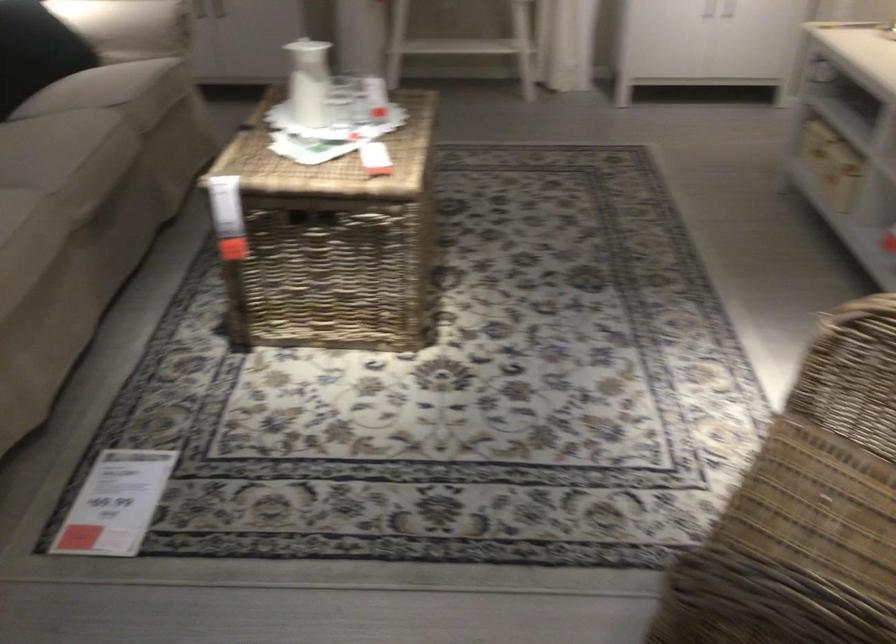
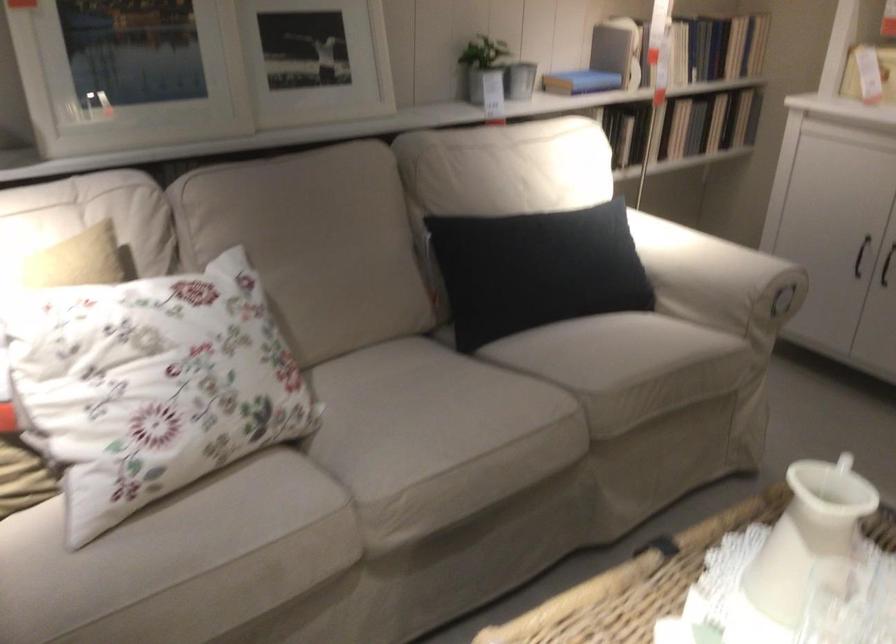
The point at (73, 182) is marked in the first image. Where is the corresponding point in the second image?

(398, 494)